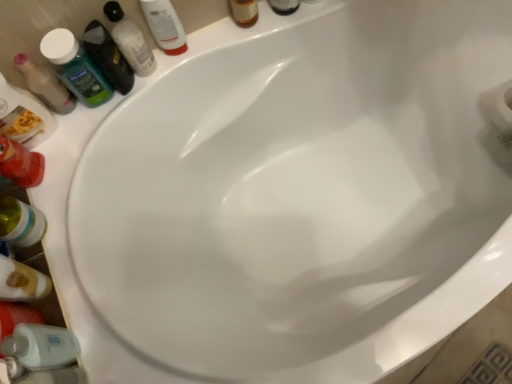
Question: From the image's perspective, is translucent plastic mouthwash at upper left, positioned as the 4th mouthwash in right-to-left order, below green matte mouthwash at upper left, marked as the 3th mouthwash in a left-to-right arrangement?

Choices:
 (A) yes
 (B) no

Answer: (A)

Question: Could you tell me if translucent plastic mouthwash at upper left, positioned as the 4th mouthwash in right-to-left order, is turned towards green matte mouthwash at upper left, marked as the 3th mouthwash in a left-to-right arrangement?

Choices:
 (A) yes
 (B) no

Answer: (B)

Question: From a real-world perspective, is translucent plastic mouthwash at upper left, which is the 1th mouthwash from left to right, under green matte mouthwash at upper left, marked as the 3th mouthwash in a left-to-right arrangement?

Choices:
 (A) yes
 (B) no

Answer: (A)

Question: Is translucent plastic mouthwash at upper left, which is the 1th mouthwash from left to right, directly adjacent to green matte mouthwash at upper left, placed as the second mouthwash when sorted from right to left?

Choices:
 (A) yes
 (B) no

Answer: (B)

Question: Is translucent plastic mouthwash at upper left, positioned as the 4th mouthwash in right-to-left order, positioned in front of green matte mouthwash at upper left, marked as the 3th mouthwash in a left-to-right arrangement?

Choices:
 (A) no
 (B) yes

Answer: (A)

Question: In the image, is translucent plastic mouthwash at upper left, which is the 1th mouthwash from left to right, on the left side or the right side of translucent plastic shampoo bottle at upper left, which ranks as the 1th toiletry in left-to-right order?

Choices:
 (A) right
 (B) left

Answer: (B)

Question: In terms of size, does translucent plastic mouthwash at upper left, positioned as the 4th mouthwash in right-to-left order, appear bigger or smaller than translucent plastic shampoo bottle at upper left, the first toiletry ordered from the bottom?

Choices:
 (A) small
 (B) big

Answer: (A)

Question: From the image's perspective, relative to translucent plastic shampoo bottle at upper left, the first toiletry ordered from the bottom, is translucent plastic mouthwash at upper left, which is the 1th mouthwash from left to right, above or below?

Choices:
 (A) above
 (B) below

Answer: (B)

Question: Which is correct: translucent plastic mouthwash at upper left, positioned as the 4th mouthwash in right-to-left order, is inside translucent plastic shampoo bottle at upper left, arranged as the second toiletry when viewed from the right, or outside of it?

Choices:
 (A) inside
 (B) outside

Answer: (B)

Question: Is translucent plastic mouthwash at upper left, positioned as the 4th mouthwash in right-to-left order, wider or thinner than translucent plastic mouthwash at upper left, the 3th mouthwash viewed from the right?

Choices:
 (A) wide
 (B) thin

Answer: (B)

Question: In the image, is translucent plastic mouthwash at upper left, positioned as the 4th mouthwash in right-to-left order, positioned in front of or behind translucent plastic mouthwash at upper left, the 3th mouthwash viewed from the right?

Choices:
 (A) front
 (B) behind

Answer: (B)

Question: Is translucent plastic mouthwash at upper left, which is the 1th mouthwash from left to right, bigger or smaller than translucent plastic mouthwash at upper left, which ranks as the second mouthwash in left-to-right order?

Choices:
 (A) big
 (B) small

Answer: (B)

Question: Considering the relative positions of translucent plastic mouthwash at upper left, which is the 1th mouthwash from left to right, and translucent plastic mouthwash at upper left, which ranks as the second mouthwash in left-to-right order, in the image provided, is translucent plastic mouthwash at upper left, which is the 1th mouthwash from left to right, to the left or to the right of translucent plastic mouthwash at upper left, which ranks as the second mouthwash in left-to-right order,?

Choices:
 (A) right
 (B) left

Answer: (B)

Question: Considering the positions of translucent plastic bottle at lower left and translucent plastic shampoo bottle at upper left, arranged as the second toiletry when viewed from the right, in the image, is translucent plastic bottle at lower left wider or thinner than translucent plastic shampoo bottle at upper left, arranged as the second toiletry when viewed from the right,?

Choices:
 (A) thin
 (B) wide

Answer: (A)

Question: From a real-world perspective, is translucent plastic bottle at lower left physically located above or below translucent plastic shampoo bottle at upper left, which ranks as the 1th toiletry in left-to-right order?

Choices:
 (A) below
 (B) above

Answer: (B)